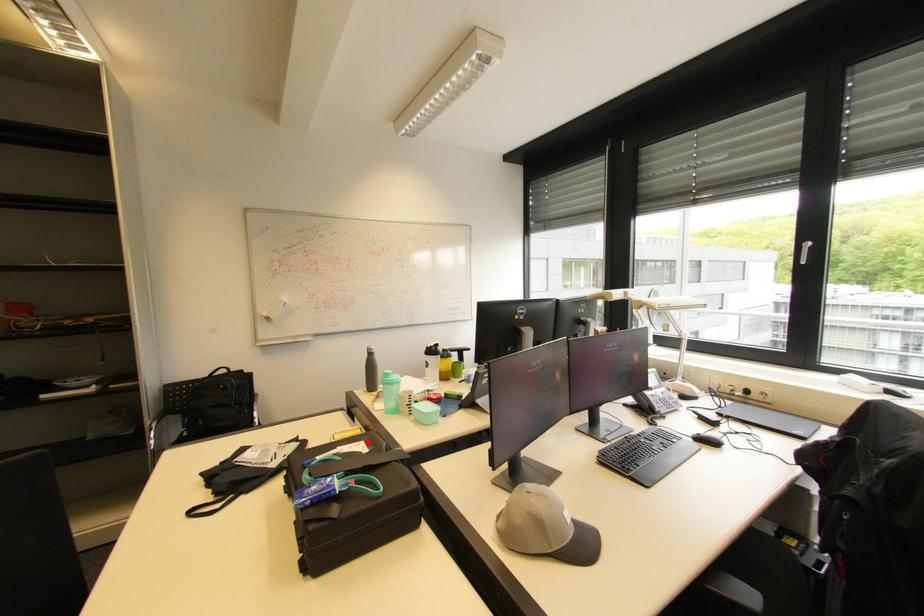
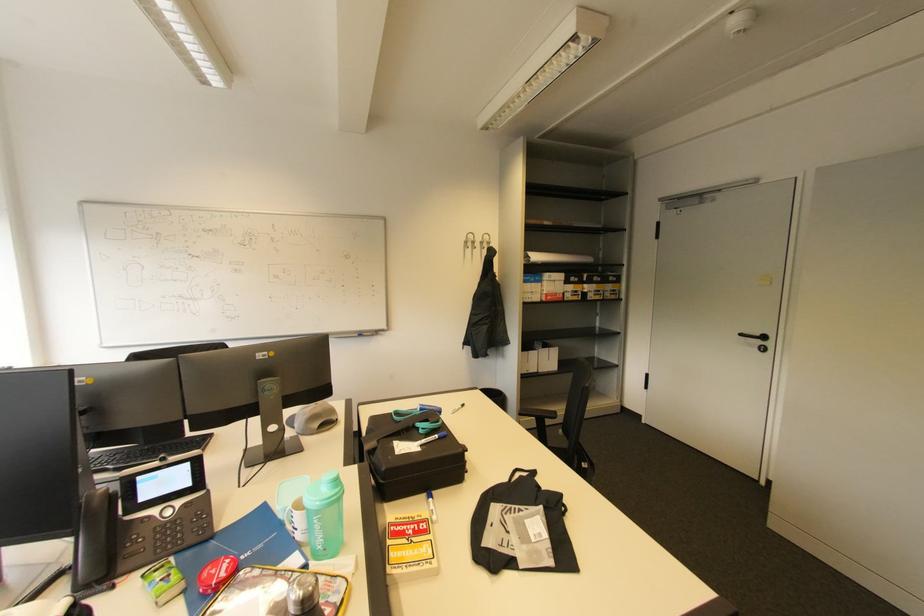
Where in the second image is the point corresponding to the highlighted location from the first image?

(402, 455)